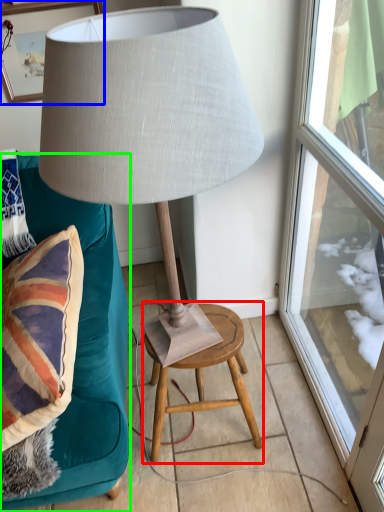
Question: Considering the real-world distances, which object is farthest from stool (highlighted by a red box)? picture frame (highlighted by a blue box) or furniture (highlighted by a green box)?

Choices:
 (A) picture frame
 (B) furniture

Answer: (A)